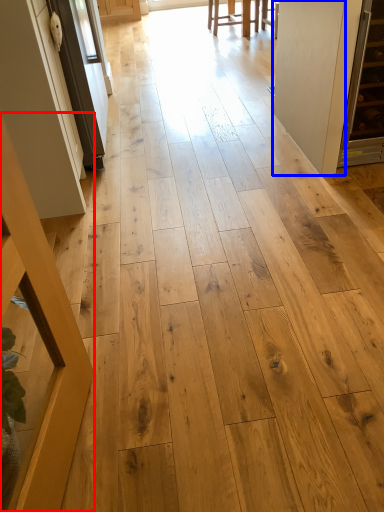
Question: Among these objects, which one is farthest to the camera, furniture (highlighted by a red box) or door (highlighted by a blue box)?

Choices:
 (A) furniture
 (B) door

Answer: (B)